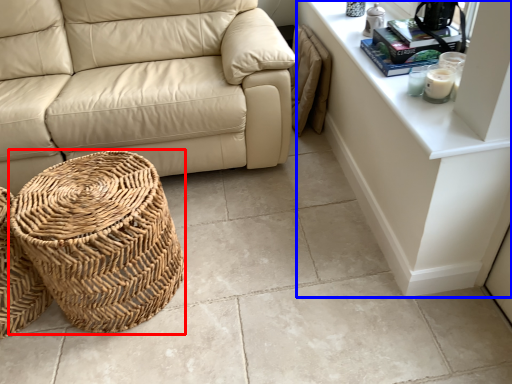
Question: Among these objects, which one is farthest to the camera, basket (highlighted by a red box) or dresser (highlighted by a blue box)?

Choices:
 (A) basket
 (B) dresser

Answer: (A)